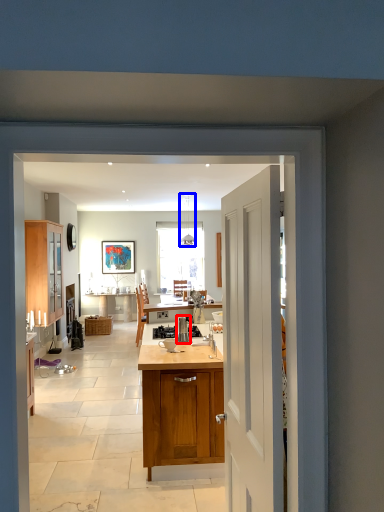
Question: Among these objects, which one is farthest to the camera, kitchen appliance (highlighted by a red box) or lamp (highlighted by a blue box)?

Choices:
 (A) kitchen appliance
 (B) lamp

Answer: (B)